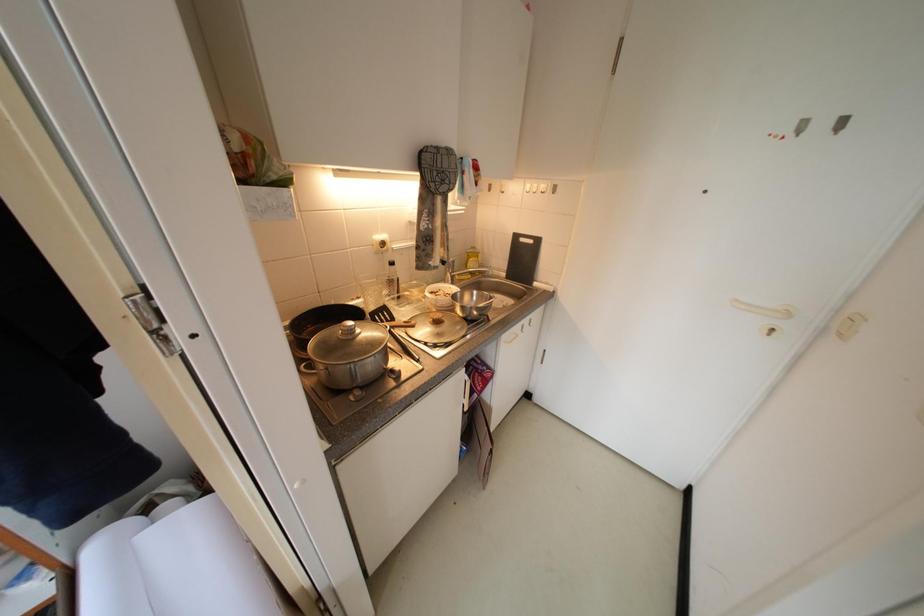
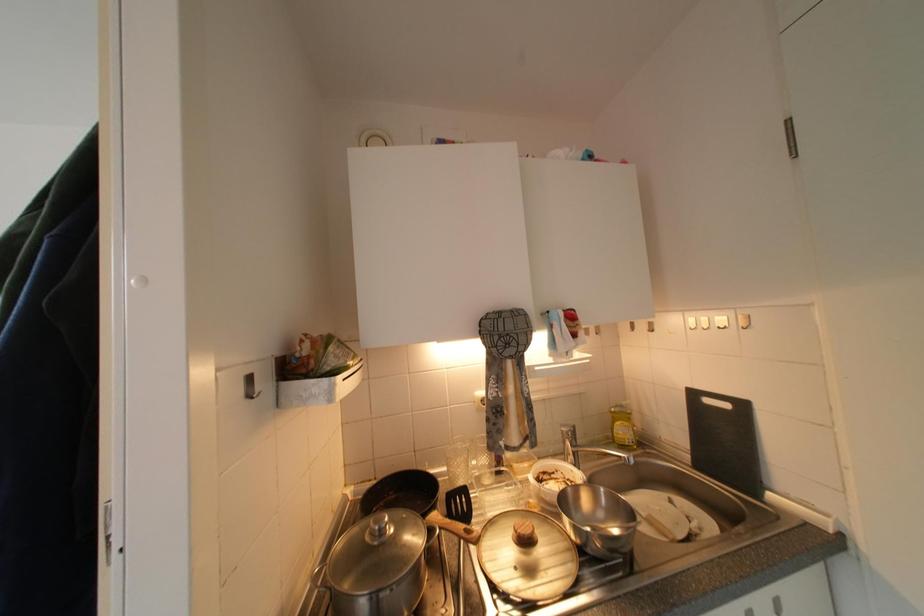
First-person continuous shooting, in which direction is the camera rotating?

The camera's rotation is toward left-up.